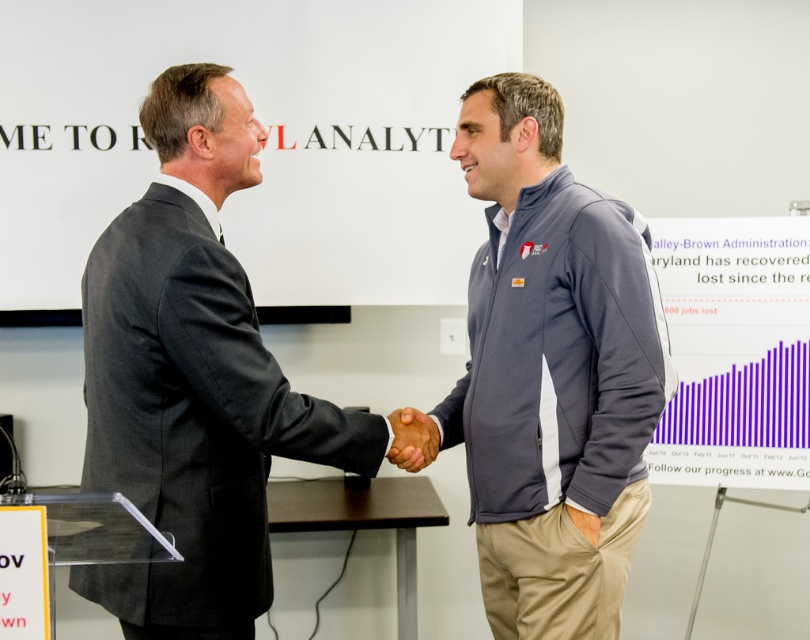
You are an observer in the conference room. You see the dark gray suit at center and the brown leather hand at center. Which object is positioned higher in the image?

The dark gray suit at center is located above the brown leather hand at center, so it is positioned higher in the image.

You are a photographer in the room. You need to capture a photo where the gray fleece jacket at center is visible above the brown leather hand at center. Is this possible given the current arrangement?

Yes, because the gray fleece jacket at center is already positioned above the brown leather hand at center in the current arrangement.

You are a photographer setting up for a group photo in the conference room. You need to ensure that both the gray fleece jacket at center and the dark gray suit at center are clearly visible in the frame. Given their sizes, which object should you focus on to ensure proper exposure?

The gray fleece jacket at center is larger in size than the dark gray suit at center, so focusing on the gray fleece jacket at center would ensure proper exposure since it occupies more of the frame.